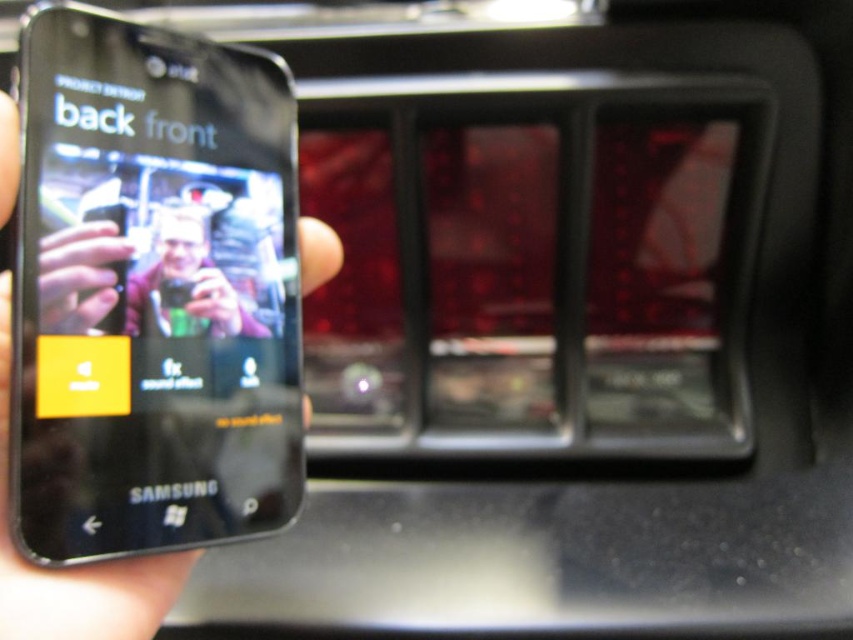
Question: In this image, where is black glossy phone at left located relative to black matte phone at left?

Choices:
 (A) left
 (B) right

Answer: (B)

Question: Among these points, which one is farthest from the camera?

Choices:
 (A) (155, 244)
 (B) (3, 216)
 (C) (30, 83)

Answer: (A)

Question: Does black matte phone at left have a larger size compared to matte black phone at left?

Choices:
 (A) no
 (B) yes

Answer: (B)

Question: Which of the following is the farthest from the observer?

Choices:
 (A) black glossy phone at left
 (B) matte black phone at left

Answer: (B)

Question: Which object is positioned farthest from the black glossy phone at left?

Choices:
 (A) black matte phone at left
 (B) matte black phone at left

Answer: (B)

Question: From the image, what is the correct spatial relationship of black glossy phone at left in relation to matte black phone at left?

Choices:
 (A) left
 (B) right

Answer: (A)